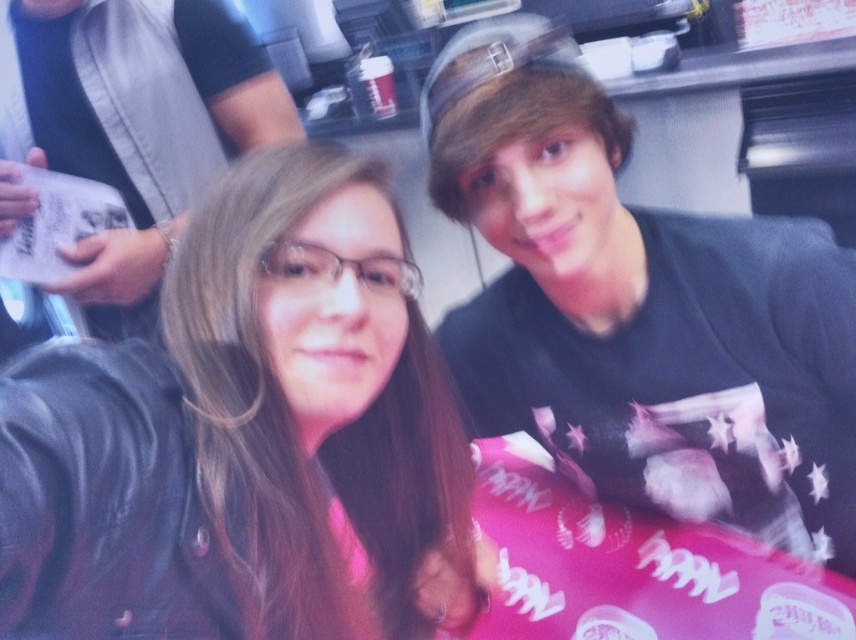
You are a photographer adjusting the camera focus. You notice the black matte shirt at upper right and the matte black hair at left. Which object should you focus on first if you want to ensure both are in focus, considering their sizes?

The black matte shirt at upper right should be focused on first because it has a larger size compared to the matte black hair at left, so focusing on the larger object first ensures both can be in focus.

You are trying to decide which piece of clothing to buy between the matte black jacket at center and the black matte shirt at upper right. Which one is smaller in size?

The matte black jacket at center has a smaller size compared to the black matte shirt at upper right, so the matte black jacket at center is the smaller one.